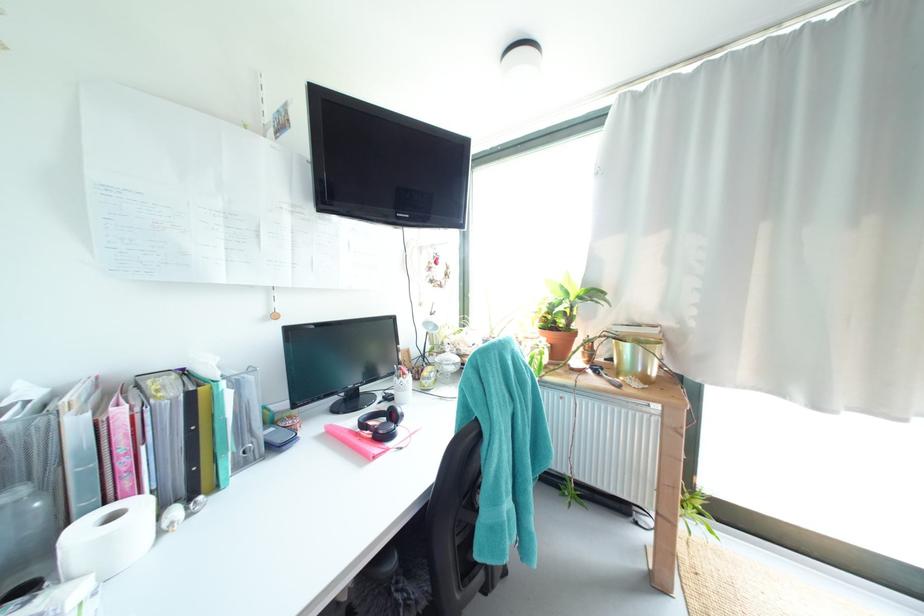
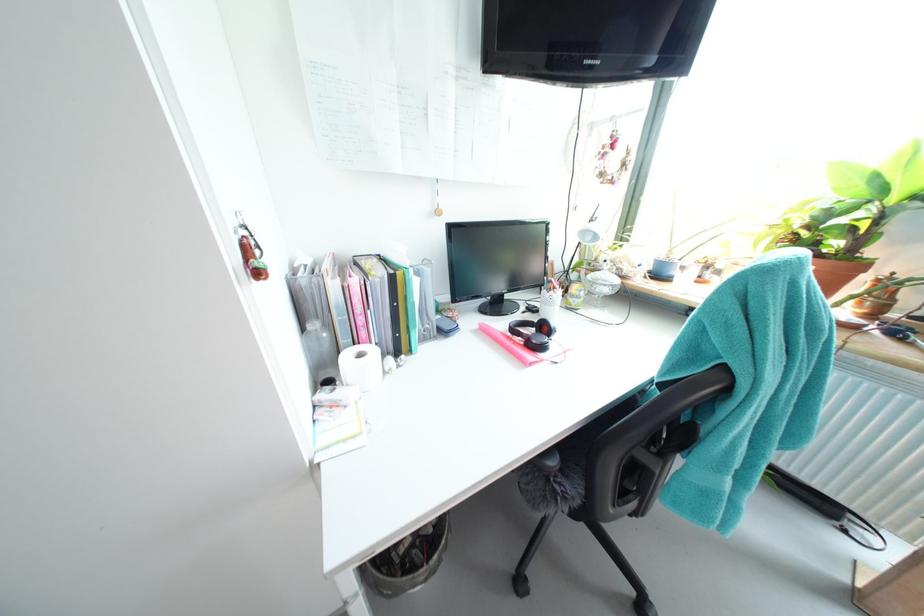
Where in the second image is the point corresponding to the point at 407,379 from the first image?

(556, 292)